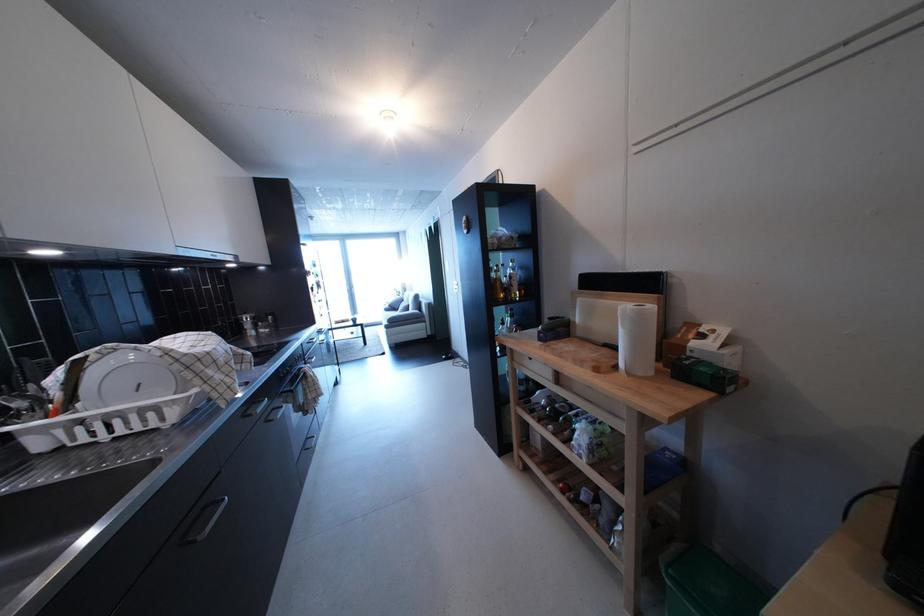
This screenshot has width=924, height=616. What do you see at coordinates (527, 361) in the screenshot?
I see `a wooden drawer handle` at bounding box center [527, 361].